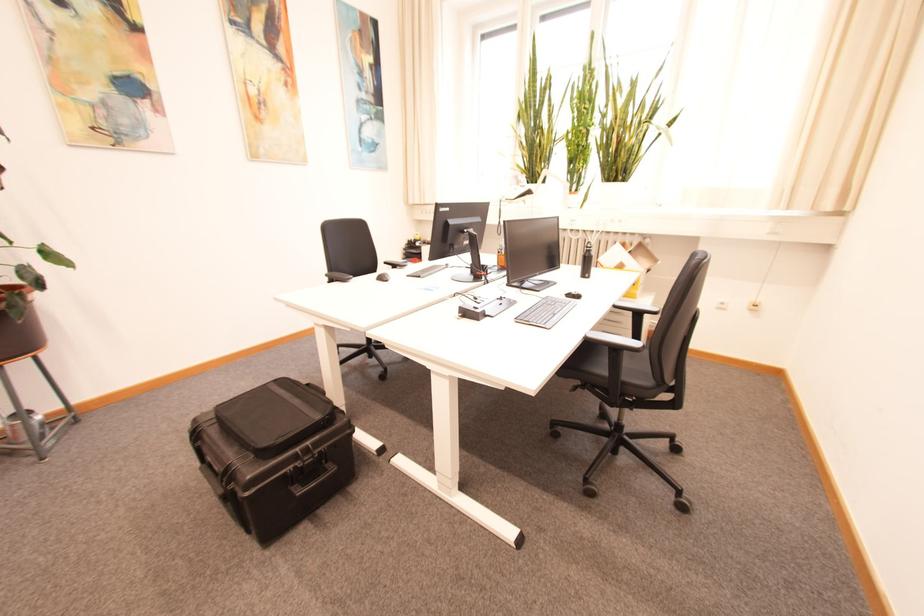
This screenshot has width=924, height=616. I want to click on black bag handle, so click(x=317, y=390).